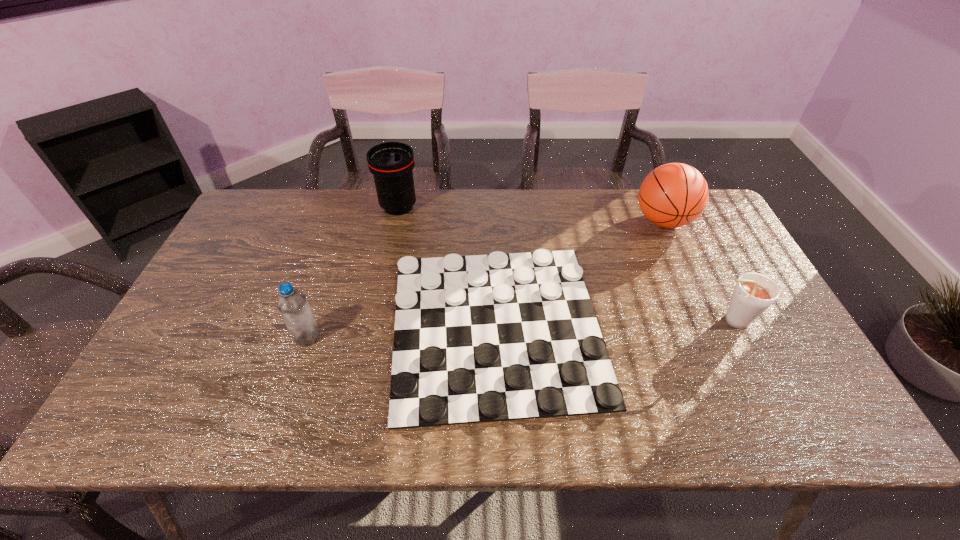
In the image, there is a desktop. What are the coordinates of `free space at the left edge` in the screenshot? It's located at (198, 373).

Where is `vacant space at the right edge of the desktop`? The image size is (960, 540). vacant space at the right edge of the desktop is located at coordinates (735, 347).

I want to click on vacant space at the far left corner of the desktop, so click(x=264, y=228).

The width and height of the screenshot is (960, 540). In the image, there is a desktop. Identify the location of free space at the far right corner. (693, 225).

You are a GUI agent. You are given a task and a screenshot of the screen. Output one action in this format:
    pyautogui.click(x=<x>, y=<y>)
    Task: Click on the free space between the gameboard and the root beer
    The width and height of the screenshot is (960, 540).
    Given the screenshot: What is the action you would take?
    pyautogui.click(x=613, y=323)

I want to click on empty location between the leftmost object and the telephoto lens, so click(x=353, y=272).

Locate an element on the screen. The height and width of the screenshot is (540, 960). empty space that is in between the root beer and the basketball is located at coordinates (697, 271).

Locate an element on the screen. The height and width of the screenshot is (540, 960). free space that is in between the root beer and the basketball is located at coordinates (697, 271).

You are a GUI agent. You are given a task and a screenshot of the screen. Output one action in this format:
    pyautogui.click(x=<x>, y=<y>)
    Task: Click on the vacant area between the leftmost object and the telephoto lens
    The height and width of the screenshot is (540, 960).
    Given the screenshot: What is the action you would take?
    pyautogui.click(x=353, y=272)

The width and height of the screenshot is (960, 540). Identify the location of vacant area that lies between the basketball and the root beer. (697, 271).